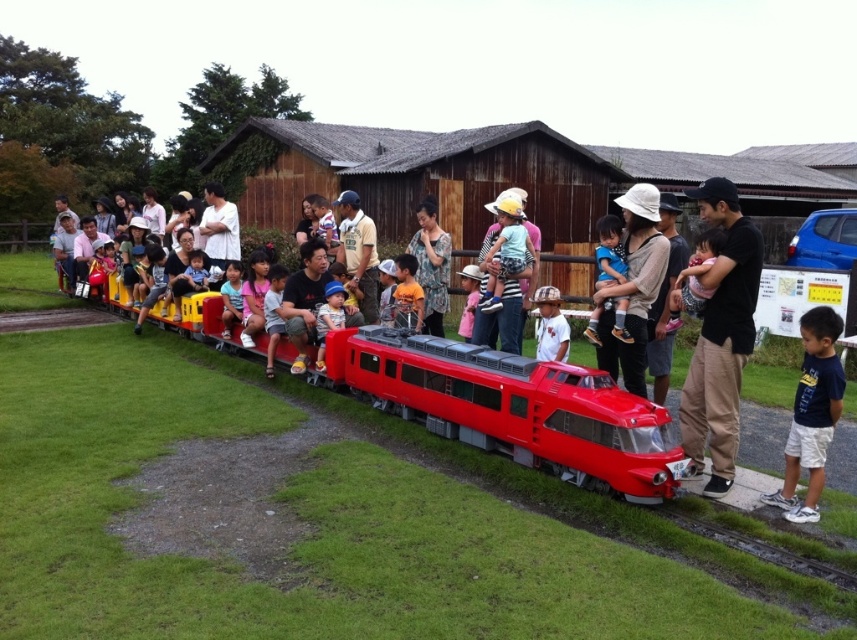
Question: In this image, where is navy blue t-shirt at center located relative to light blue denim shorts at center?

Choices:
 (A) above
 (B) below

Answer: (B)

Question: Is shiny plastic train at center positioned behind light blue denim shorts at center?

Choices:
 (A) yes
 (B) no

Answer: (B)

Question: Which point is closer to the camera?

Choices:
 (A) matte plastic toy at center
 (B) light blue denim shorts at center
 (C) navy blue t-shirt at center
 (D) shiny plastic train at center

Answer: (C)

Question: Does light blue denim shorts at center appear on the right side of matte plastic toy at center?

Choices:
 (A) no
 (B) yes

Answer: (B)

Question: Which point is closer to the camera?

Choices:
 (A) matte plastic toy at center
 (B) navy blue t-shirt at center
 (C) black matte shirt at right
 (D) shiny plastic train at center

Answer: (B)

Question: Which object is the closest to the navy blue t-shirt at center?

Choices:
 (A) black matte shirt at right
 (B) matte yellow shirt at center

Answer: (A)